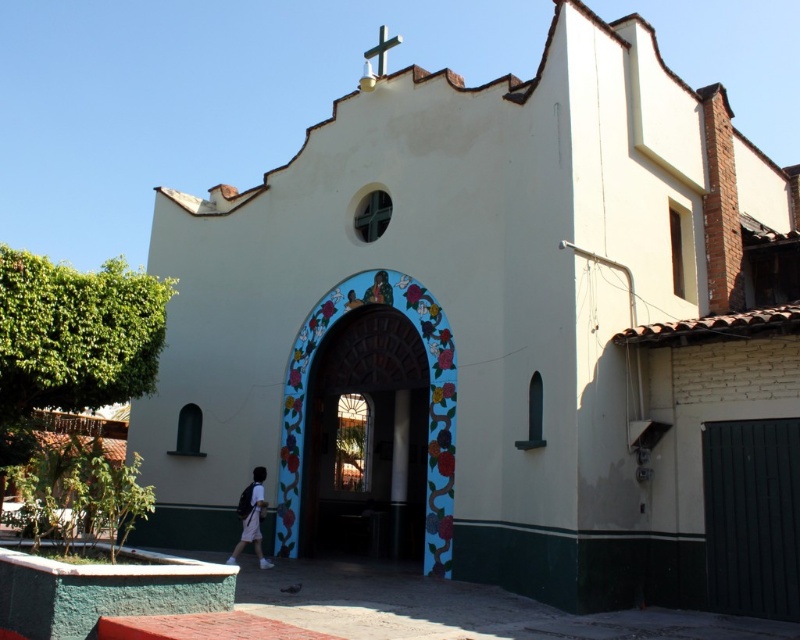
Question: Which object is farther from the camera taking this photo?

Choices:
 (A) painted brick archway at center
 (B) green metallic cross at upper center

Answer: (B)

Question: Is dark green wooden gate at lower right to the left of green metallic cross at upper center from the viewer's perspective?

Choices:
 (A) no
 (B) yes

Answer: (A)

Question: Is the position of white fabric backpack at center less distant than that of green metallic cross at upper center?

Choices:
 (A) no
 (B) yes

Answer: (B)

Question: Does white fabric backpack at center have a larger size compared to green metallic cross at upper center?

Choices:
 (A) yes
 (B) no

Answer: (B)

Question: Which of the following is the farthest from the observer?

Choices:
 (A) (248, 484)
 (B) (332, 525)
 (C) (384, 45)
 (D) (741, 545)

Answer: (B)

Question: Which of the following is the farthest from the observer?

Choices:
 (A) (258, 524)
 (B) (418, 372)
 (C) (786, 534)
 (D) (380, 32)

Answer: (D)